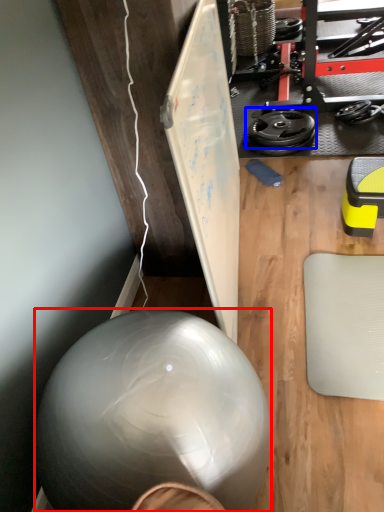
Question: Which object is further to the camera taking this photo, ball (highlighted by a red box) or wheel (highlighted by a blue box)?

Choices:
 (A) ball
 (B) wheel

Answer: (B)